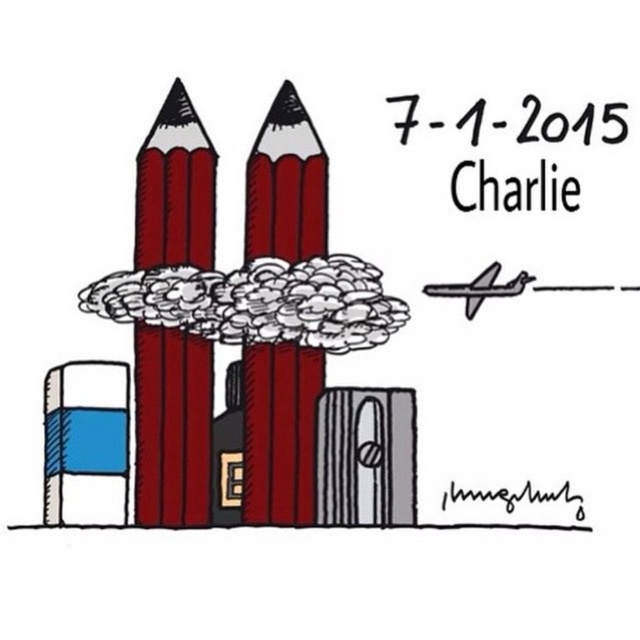
You are an art student analyzing the cartoon. You see the matte red crayon at left and the matte red pencil at center. Which object is positioned farther to the left side of the image?

The matte red crayon at left is positioned farther to the left side of the image than the matte red pencil at center.

You are an artist trying to decide which tool to use for a project. You have the matte red crayon at left and the matte red pencil at center. Which one is taller?

The matte red crayon at left is taller than the matte red pencil at center.

You are a photographer standing 1 meter away from the matte red crayon at left. Can you take a clear photo of it without moving closer?

The matte red crayon at left is exactly 1.01 meters away from the camera, so you can take a clear photo without moving closer since it is just slightly beyond the 1 meter distance.